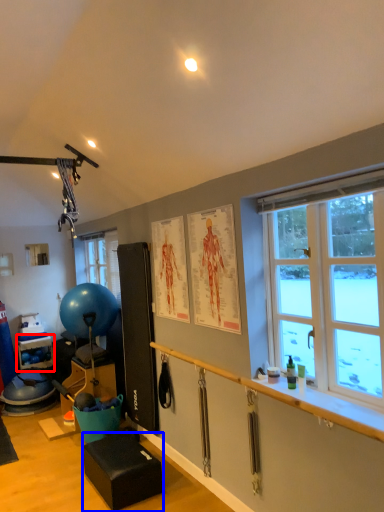
Question: Which point is further to the camera, shelf (highlighted by a red box) or furniture (highlighted by a blue box)?

Choices:
 (A) shelf
 (B) furniture

Answer: (A)